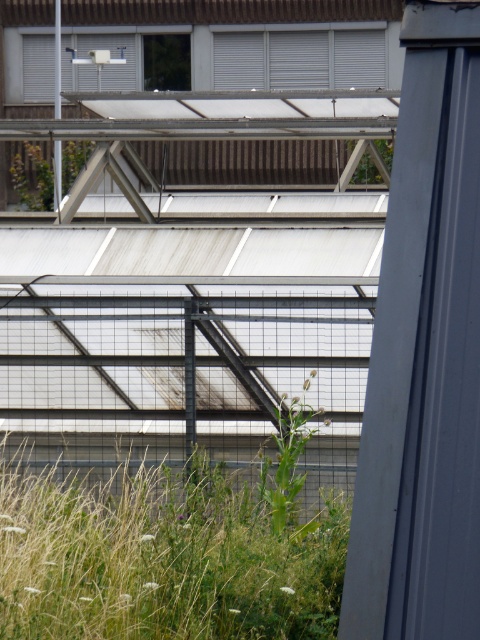
You are standing at the entrance of the building and see the point marked as point [186,371]. What object is located at that point?

The black metal fence at center is located at point [186,371].

You are a maintenance worker tasked with trimming the green leafy grass at lower left and inspecting the black metal fence at center. Which object should you attend to first based on their proximity to your current position?

You should attend to the black metal fence at center first because it is closer to you than the green leafy grass at lower left, which is further away.